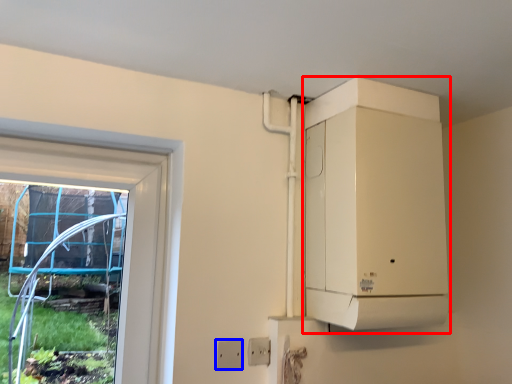
Question: Which object is further to the camera taking this photo, appliance (highlighted by a red box) or electric outlet (highlighted by a blue box)?

Choices:
 (A) appliance
 (B) electric outlet

Answer: (B)